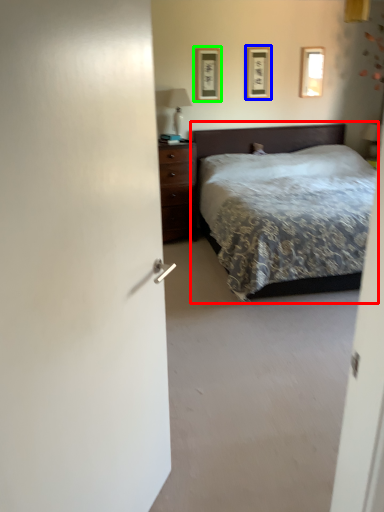
Question: Which is nearer to the bed (highlighted by a red box)? picture frame (highlighted by a blue box) or picture frame (highlighted by a green box).

Choices:
 (A) picture frame
 (B) picture frame

Answer: (A)